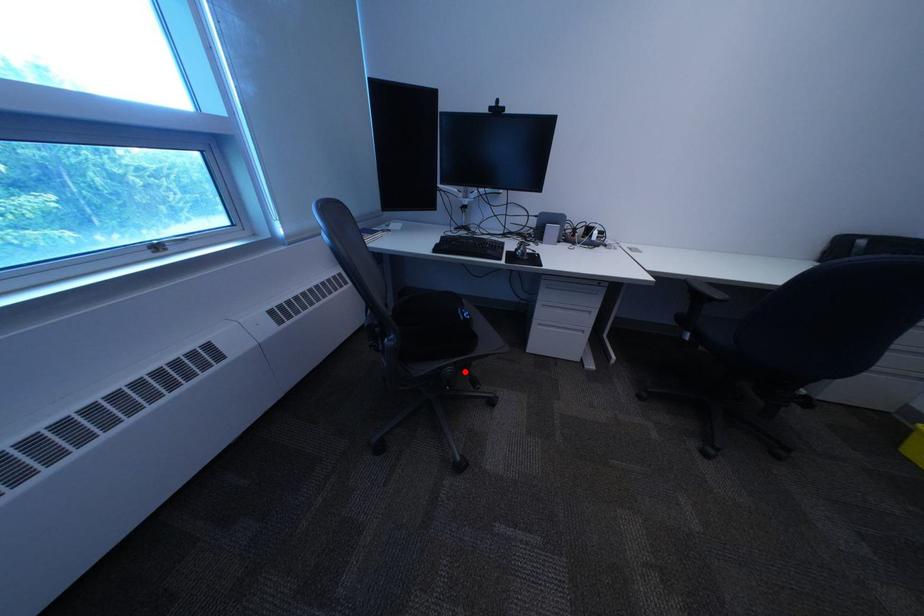
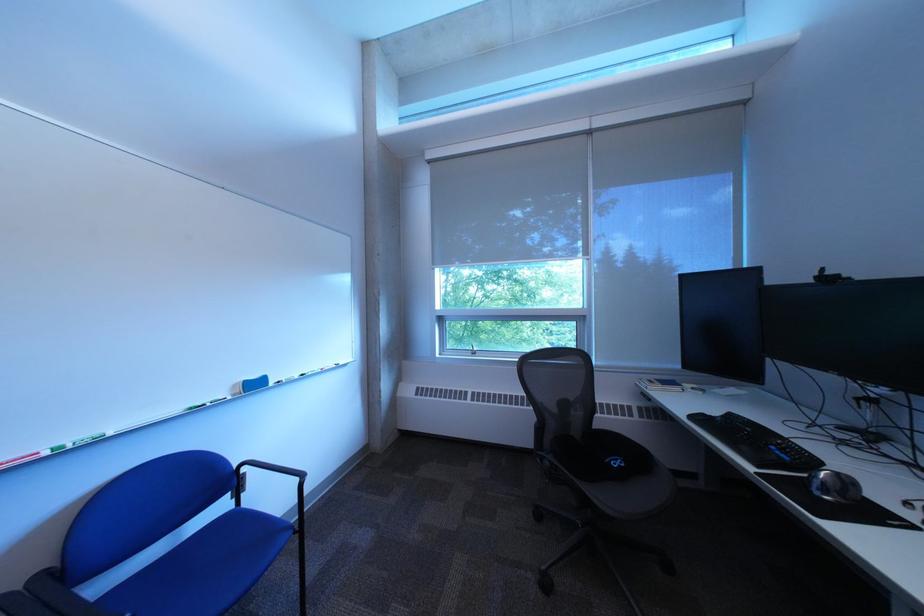
In the second image, find the point that corresponds to the highlighted location in the first image.

(563, 464)